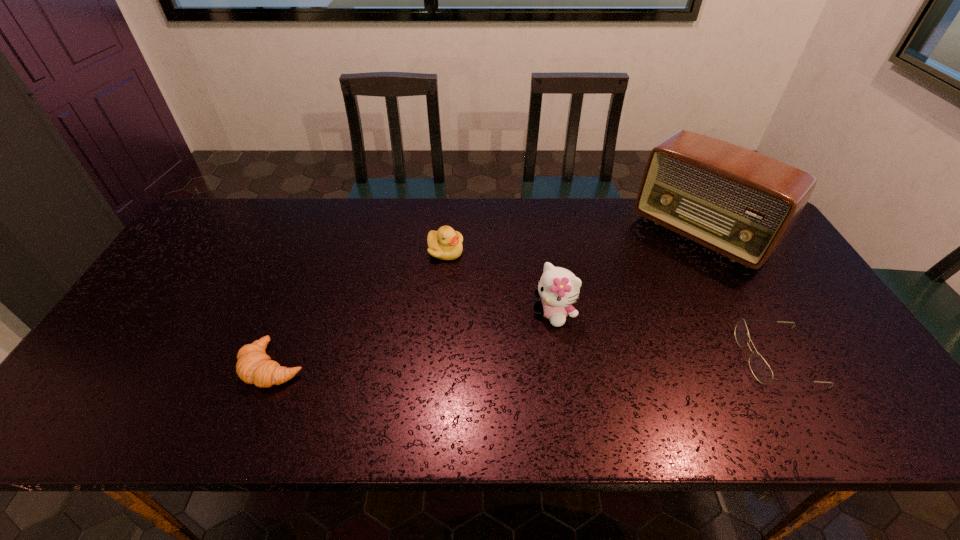
The image size is (960, 540). In order to click on duckling at the far edge in this screenshot , I will do `click(446, 244)`.

Locate an element on the screen. This screenshot has height=540, width=960. radio receiver that is at the far edge is located at coordinates (739, 203).

Find the location of a particular element. The image size is (960, 540). crescent roll positioned at the near edge is located at coordinates [254, 366].

This screenshot has height=540, width=960. What are the coordinates of `spectacles that is at the near edge` in the screenshot? It's located at (760, 369).

The image size is (960, 540). Find the location of `spectacles located at the right edge`. spectacles located at the right edge is located at coordinates (760, 369).

Locate an element on the screen. The height and width of the screenshot is (540, 960). radio receiver that is at the right edge is located at coordinates (739, 203).

You are a GUI agent. You are given a task and a screenshot of the screen. Output one action in this format:
    pyautogui.click(x=<x>, y=<y>)
    Task: Click on the object that is positioned at the far right corner
    The height and width of the screenshot is (540, 960).
    Given the screenshot: What is the action you would take?
    pyautogui.click(x=739, y=203)

At what (x,y) coordinates should I click in order to perform the action: click on object that is at the near right corner. Please return your answer as a coordinate pair (x, y). This screenshot has width=960, height=540. Looking at the image, I should click on (760, 369).

You are a GUI agent. You are given a task and a screenshot of the screen. Output one action in this format:
    pyautogui.click(x=<x>, y=<y>)
    Task: Click on the vacant space at the far edge
    The width and height of the screenshot is (960, 540).
    Given the screenshot: What is the action you would take?
    pyautogui.click(x=541, y=206)

In the image, there is a desktop. Where is `free space at the near edge`? The height and width of the screenshot is (540, 960). free space at the near edge is located at coordinates (788, 394).